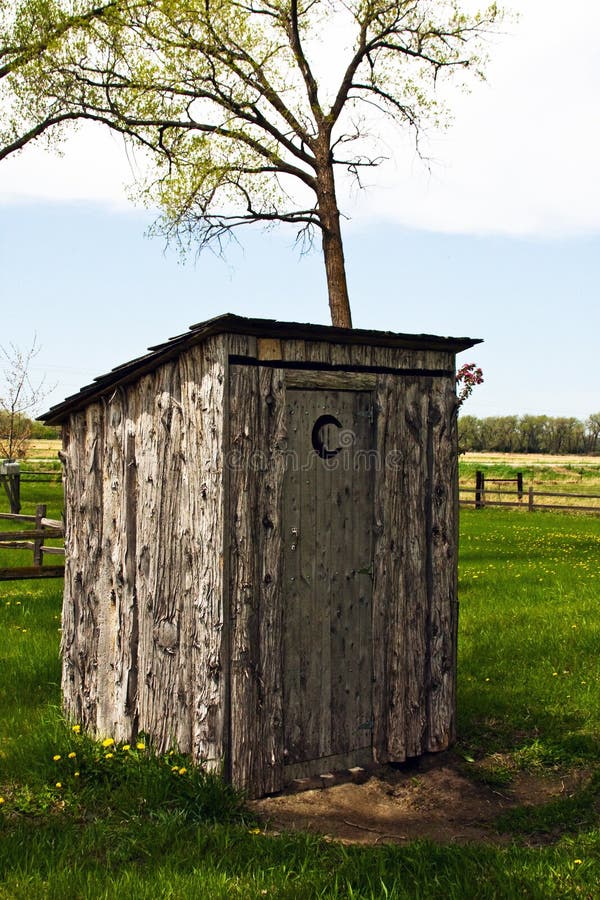
The height and width of the screenshot is (900, 600). Identify the location of wall. (153, 516), (428, 482), (250, 516).